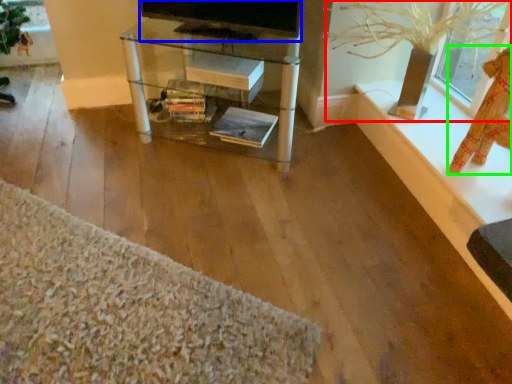
Question: Considering the real-world distances, which object is closest to plant (highlighted by a red box)? television (highlighted by a blue box) or doll (highlighted by a green box).

Choices:
 (A) television
 (B) doll

Answer: (B)